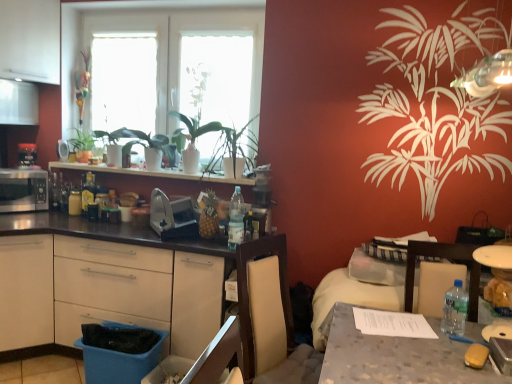
Identify the location of free space to the left of satin silver toaster at center, acting as the first appliance starting from the right. (129, 232).